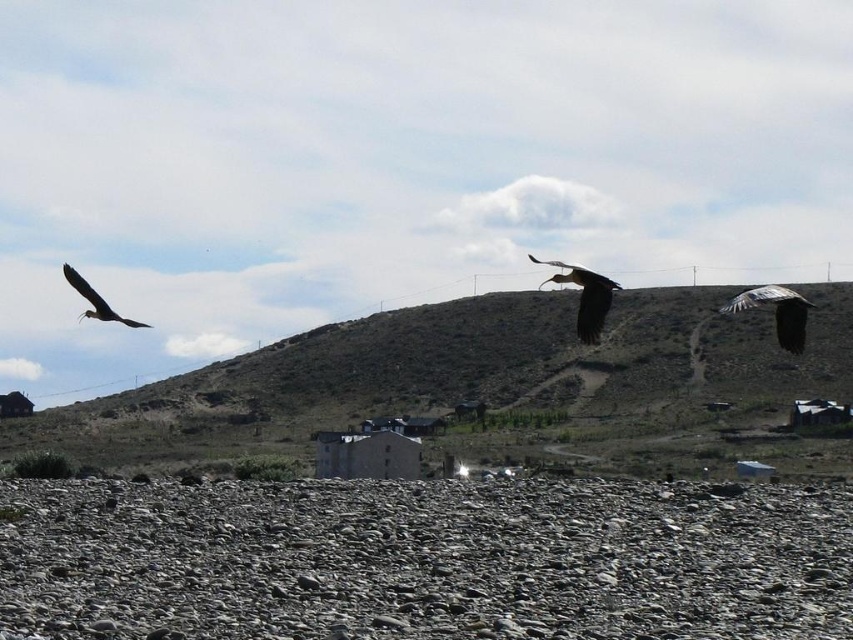
Does gray gravelly rocks at lower center have a greater height compared to dark brown feathered eagle at upper right?

No.

Can you confirm if gray gravelly rocks at lower center is shorter than dark brown feathered eagle at upper right?

Yes, gray gravelly rocks at lower center is shorter than dark brown feathered eagle at upper right.

Who is more distant from viewer, (4, 588) or (793, 342)?

Positioned behind is point (793, 342).

Where is `gray gravelly rocks at lower center`? The height and width of the screenshot is (640, 853). gray gravelly rocks at lower center is located at coordinates (422, 560).

Is white feathered bird at center above shiny black bird at left?

Yes, white feathered bird at center is above shiny black bird at left.

Between point (549, 260) and point (93, 298), which one is positioned behind?

The point (93, 298) is behind.

What do you see at coordinates (585, 298) in the screenshot?
I see `white feathered bird at center` at bounding box center [585, 298].

Identify the location of white feathered bird at center. The height and width of the screenshot is (640, 853). (585, 298).

Is green grassy hillside at center further to camera compared to white feathered bird at center?

Yes, green grassy hillside at center is behind white feathered bird at center.

Which is below, green grassy hillside at center or white feathered bird at center?

green grassy hillside at center is lower down.

Which is behind, point (718, 317) or point (577, 308)?

Point (718, 317)

Locate an element on the screen. green grassy hillside at center is located at coordinates (477, 378).